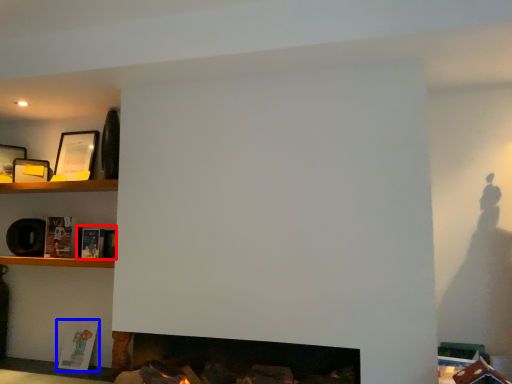
Question: Which object is closer to the camera taking this photo, book (highlighted by a red box) or book (highlighted by a blue box)?

Choices:
 (A) book
 (B) book

Answer: (A)